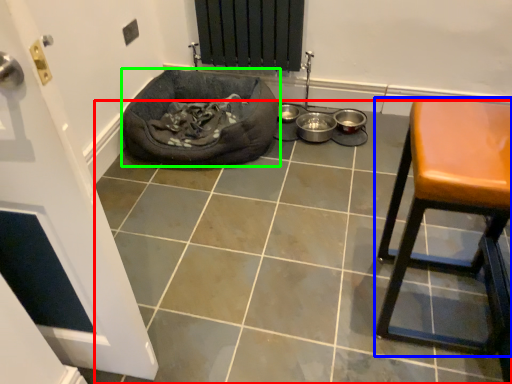
Question: Which object is positioned closest to tile (highlighted by a red box)? Select from furniture (highlighted by a blue box) and dog bed (highlighted by a green box).

Choices:
 (A) furniture
 (B) dog bed

Answer: (A)